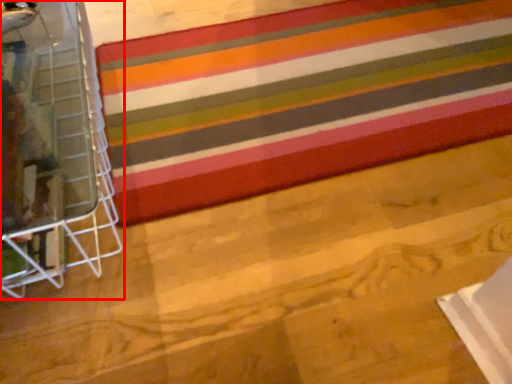
Question: Where is furniture (annotated by the red box) located in relation to quilt in the image?

Choices:
 (A) left
 (B) right

Answer: (A)